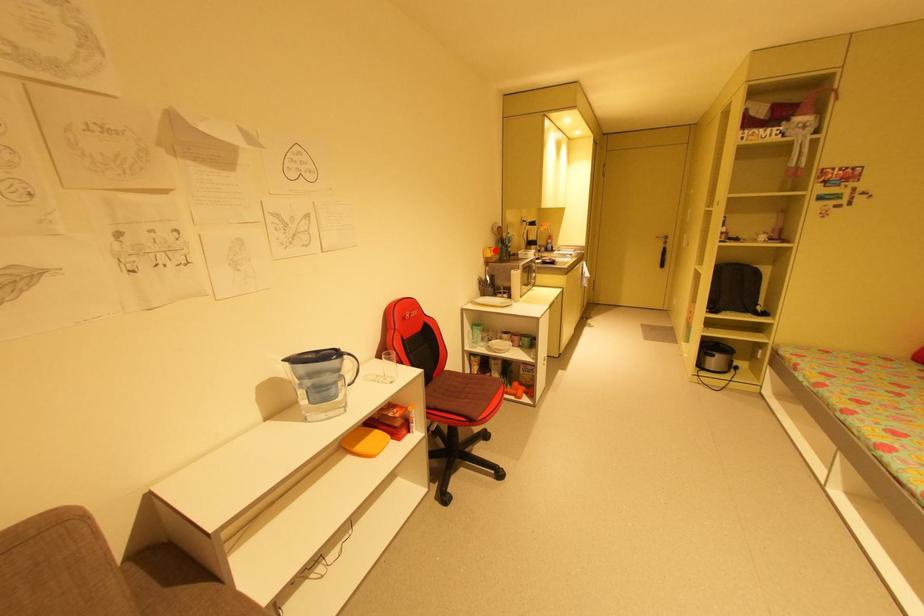
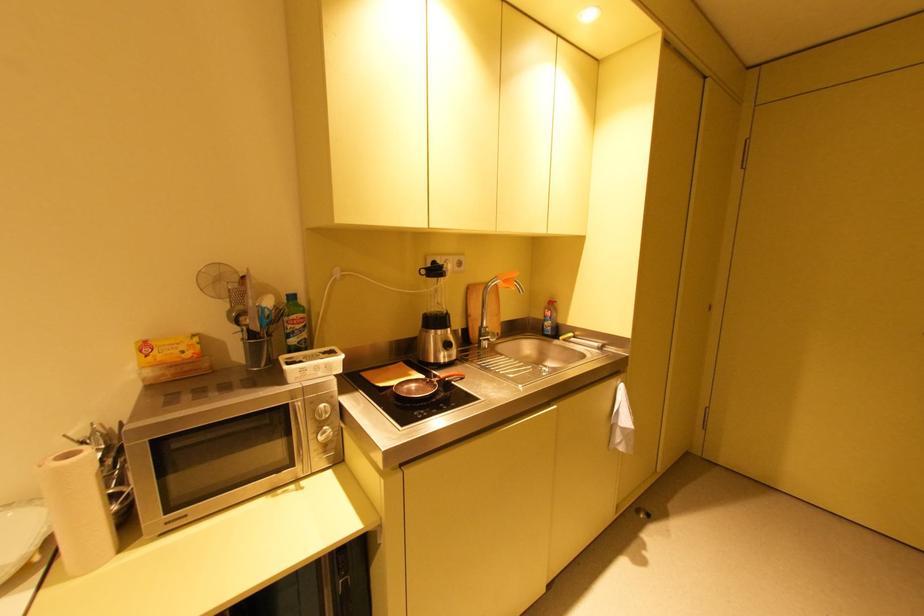
Find the pixel in the second image that matches the highlighted location in the first image.

(150, 347)